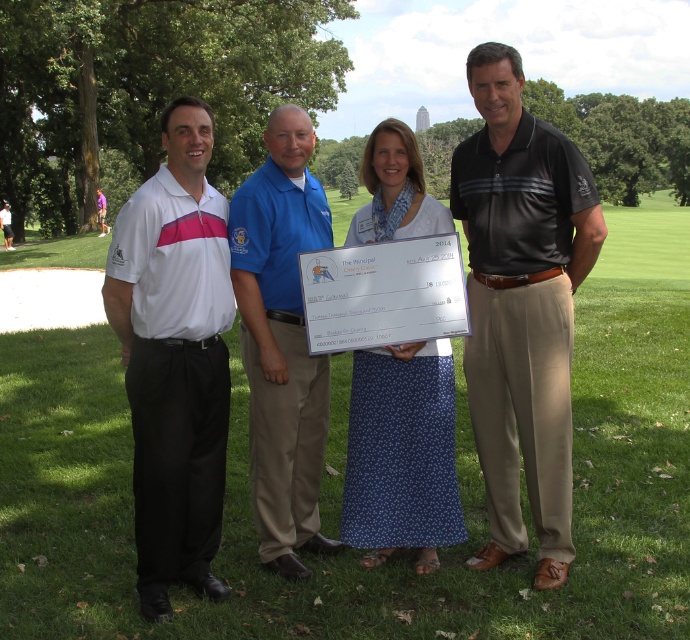
Question: Which object is the farthest from the white smooth polo shirt at left?

Choices:
 (A) white cotton shirt at upper left
 (B) blue smooth shirt at center
 (C) blue floral skirt at center

Answer: (C)

Question: Is white smooth polo shirt at left positioned in front of blue smooth shirt at center?

Choices:
 (A) no
 (B) yes

Answer: (B)

Question: Is white cotton shirt at upper left smaller than blue smooth shirt at center?

Choices:
 (A) yes
 (B) no

Answer: (B)

Question: Is white smooth polo shirt at left below blue smooth shirt at center?

Choices:
 (A) yes
 (B) no

Answer: (A)

Question: Which object is farther from the camera taking this photo?

Choices:
 (A) dark gray striped polo shirt at center
 (B) white smooth polo shirt at left
 (C) blue floral skirt at center

Answer: (C)

Question: Which of the following is the farthest from the observer?

Choices:
 (A) (226, 269)
 (B) (586, 189)
 (C) (382, 196)
 (D) (273, 276)

Answer: (C)